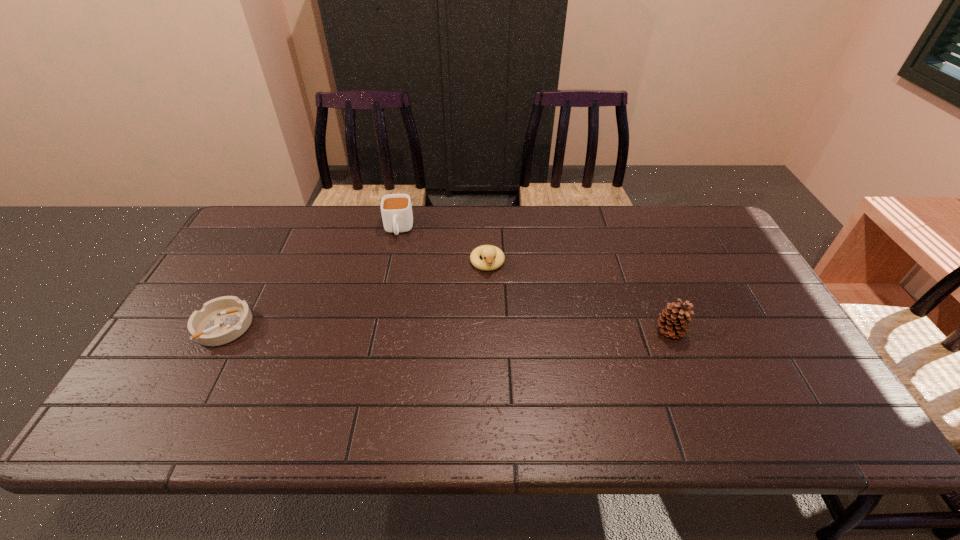
Identify the location of ashtray. (221, 320).

I want to click on the shortest object, so click(x=221, y=320).

Where is `pinecone`? The height and width of the screenshot is (540, 960). pinecone is located at coordinates (673, 319).

Find the location of a particular element. This screenshot has width=960, height=540. the rightmost object is located at coordinates (673, 319).

Where is `the second object from left to right`? The image size is (960, 540). the second object from left to right is located at coordinates (396, 209).

The height and width of the screenshot is (540, 960). Find the location of `the farthest object`. the farthest object is located at coordinates (396, 209).

This screenshot has width=960, height=540. Find the location of `the second object from right to left`. the second object from right to left is located at coordinates (493, 257).

Where is `duckling`? The height and width of the screenshot is (540, 960). duckling is located at coordinates (493, 257).

At what (x,y) coordinates should I click in order to perform the action: click on vacant area situated 0.080m on the right of the ashtray. Please return your answer as a coordinate pair (x, y). The width and height of the screenshot is (960, 540). Looking at the image, I should click on (281, 326).

What are the coordinates of `free point located on the left of the tallest object` in the screenshot? It's located at (501, 332).